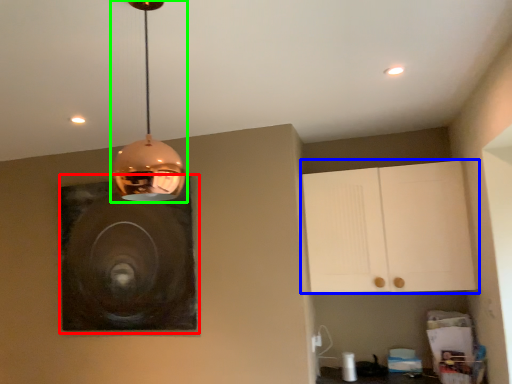
Question: Which object is the farthest from picture frame (highlighted by a red box)? Choose among these: cabinetry (highlighted by a blue box) or lamp (highlighted by a green box).

Choices:
 (A) cabinetry
 (B) lamp

Answer: (B)